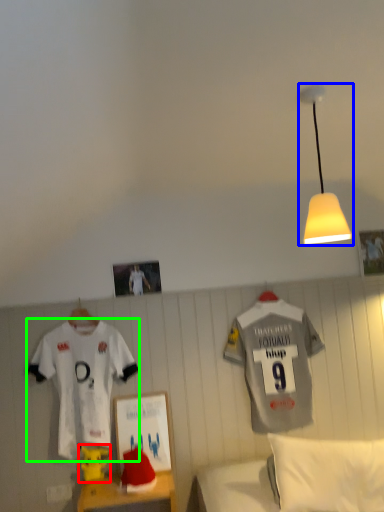
Question: Which object is positioned closest to toy (highlighted by a red box)? Select from lamp (highlighted by a blue box) and sports uniform (highlighted by a green box).

Choices:
 (A) lamp
 (B) sports uniform

Answer: (B)